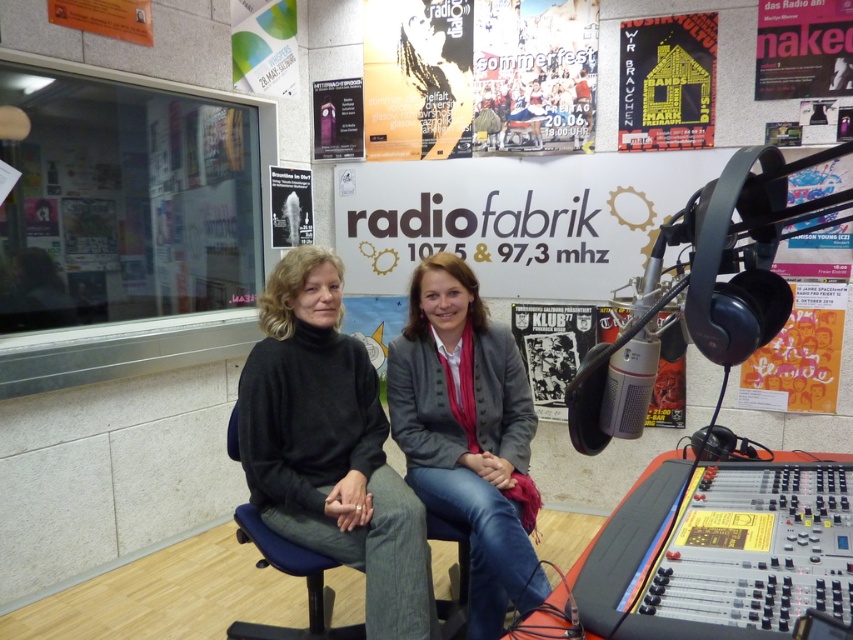
Question: Which point is closer to the camera?

Choices:
 (A) (281, 74)
 (B) (329, 125)
 (C) (795, 26)
 (D) (497, 81)

Answer: (C)

Question: Is the position of gray woolen blazer at center less distant than that of white paper poster at upper center?

Choices:
 (A) yes
 (B) no

Answer: (A)

Question: Among these points, which one is nearest to the camera?

Choices:
 (A) (347, 83)
 (B) (247, 67)
 (C) (302, 177)
 (D) (537, 51)

Answer: (D)

Question: Is dark gray sweater at center wider than white paper poster at upper center?

Choices:
 (A) no
 (B) yes

Answer: (B)

Question: Among these objects, which one is farthest from the camera?

Choices:
 (A) white paper poster at upper left
 (B) matte purple fabric poster at upper center

Answer: (B)

Question: Does dark gray sweater at center appear under matte purple fabric poster at upper center?

Choices:
 (A) no
 (B) yes

Answer: (B)